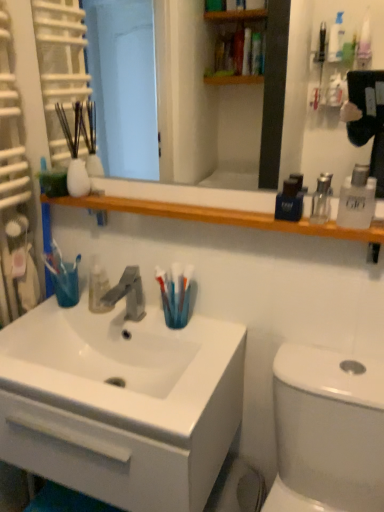
Where is `spots to the right of satin nickel faucet at center`? The height and width of the screenshot is (512, 384). spots to the right of satin nickel faucet at center is located at coordinates (190, 332).